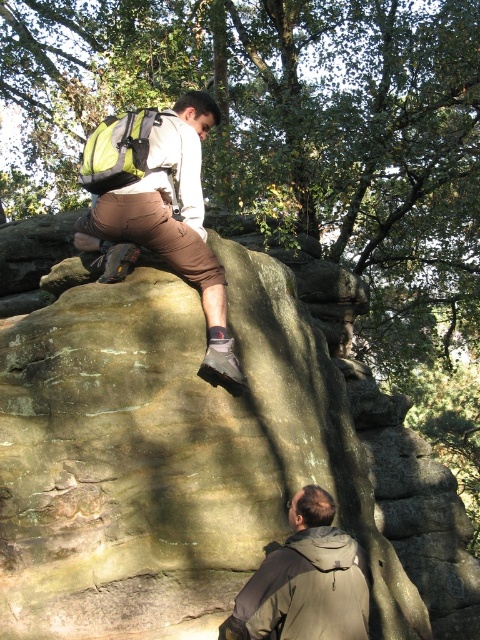
Is point (115, 179) positioned after point (277, 557)?

Yes, it is behind point (277, 557).

Does point (193, 97) come farther from viewer compared to point (292, 612)?

Yes, it is.

Where is `matte brown pants at upper center`? This screenshot has height=640, width=480. matte brown pants at upper center is located at coordinates (158, 208).

Find the location of a particular element. matte brown pants at upper center is located at coordinates coord(158,208).

Is matte brown pants at upper center below green fabric safety vest at upper left?

Indeed, matte brown pants at upper center is positioned under green fabric safety vest at upper left.

The width and height of the screenshot is (480, 640). I want to click on matte brown pants at upper center, so click(x=158, y=208).

The width and height of the screenshot is (480, 640). I want to click on matte brown pants at upper center, so click(x=158, y=208).

Does khaki fabric jacket at lower right appear on the left side of green fabric safety vest at upper left?

Incorrect, khaki fabric jacket at lower right is not on the left side of green fabric safety vest at upper left.

Is khaki fabric jacket at lower right wider than green fabric safety vest at upper left?

No, khaki fabric jacket at lower right is not wider than green fabric safety vest at upper left.

The width and height of the screenshot is (480, 640). Find the location of `khaki fabric jacket at lower right`. khaki fabric jacket at lower right is located at coordinates (305, 580).